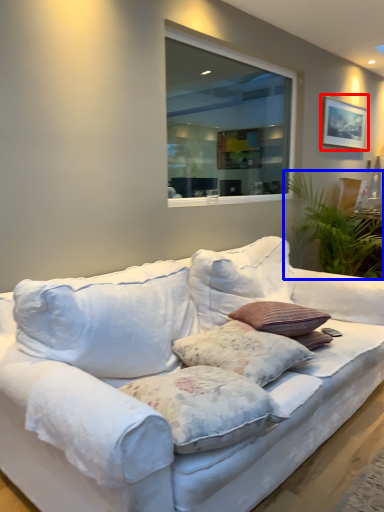
Question: Which object is further to the camera taking this photo, picture frame (highlighted by a red box) or plant (highlighted by a blue box)?

Choices:
 (A) picture frame
 (B) plant

Answer: (A)